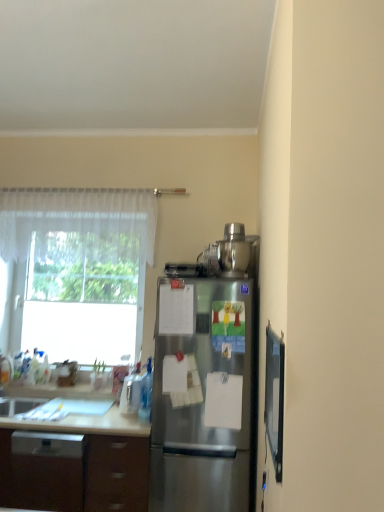
Question: In the image, is transparent glass window at left positioned in front of or behind matte black screen door at right?

Choices:
 (A) front
 (B) behind

Answer: (B)

Question: From the image's perspective, relative to matte black screen door at right, is transparent glass window at left above or below?

Choices:
 (A) below
 (B) above

Answer: (A)

Question: Considering the real-world distances, which object is farthest from the brown wood cabinet at lower left?

Choices:
 (A) stainless steel blender at upper right, marked as the 1th appliance in a top-to-bottom arrangement
 (B) stainless steel refrigerator at center
 (C) brown matte drawer at lower left
 (D) matte black screen door at right
 (E) transparent glass window at left

Answer: (A)

Question: Which of these objects is positioned closest to the stainless steel refrigerator at center?

Choices:
 (A) clear plastic container at lower left, which appears as the 1th appliance when viewed from the left
 (B) stainless steel blender at upper right, marked as the 1th appliance in a top-to-bottom arrangement
 (C) brown wood cabinet at lower left
 (D) matte black screen door at right
 (E) sheer white curtain at upper left

Answer: (D)